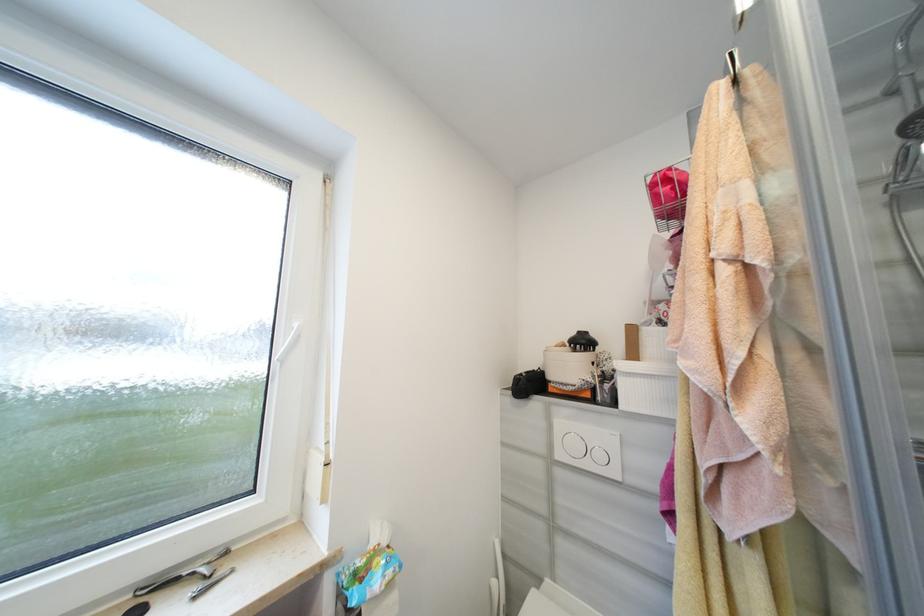
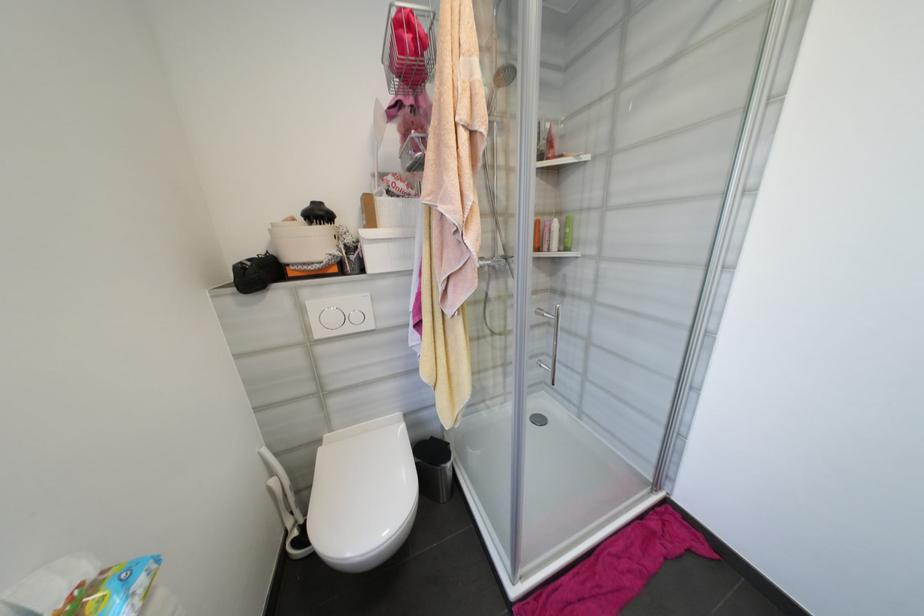
In the second image, find the point that corresponds to pixel 604 456 in the first image.

(361, 318)